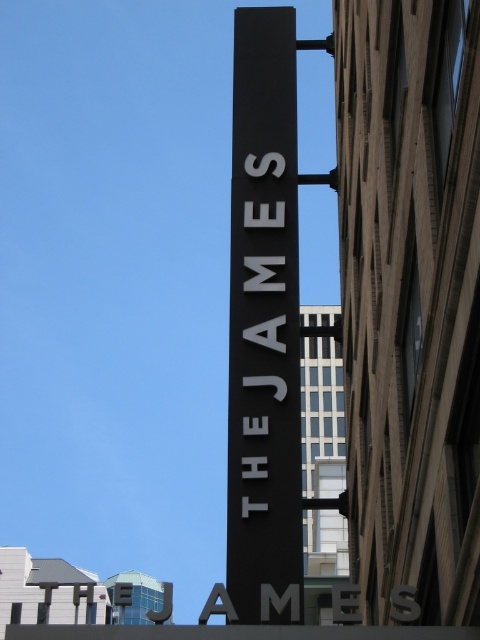
Question: Does black matte sign at center have a lesser width compared to white matte sign at center?

Choices:
 (A) no
 (B) yes

Answer: (A)

Question: Is the position of black matte sign at center less distant than that of white matte sign at center?

Choices:
 (A) yes
 (B) no

Answer: (A)

Question: Is black matte sign at center thinner than white matte sign at center?

Choices:
 (A) no
 (B) yes

Answer: (A)

Question: Which of the following is the farthest from the observer?

Choices:
 (A) white matte sign at center
 (B) black matte sign at center

Answer: (A)

Question: Which point appears farthest from the camera in this image?

Choices:
 (A) (264, 156)
 (B) (264, 442)

Answer: (A)